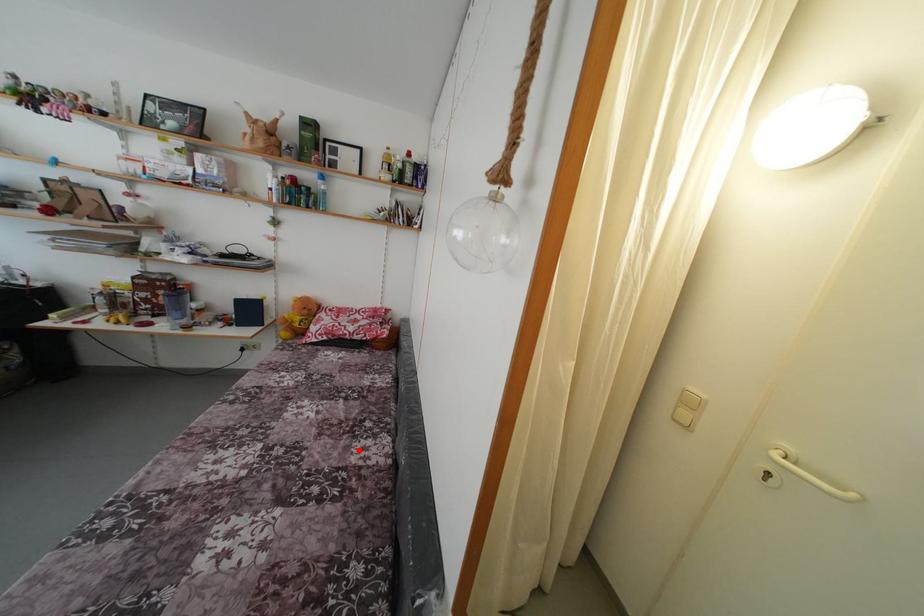
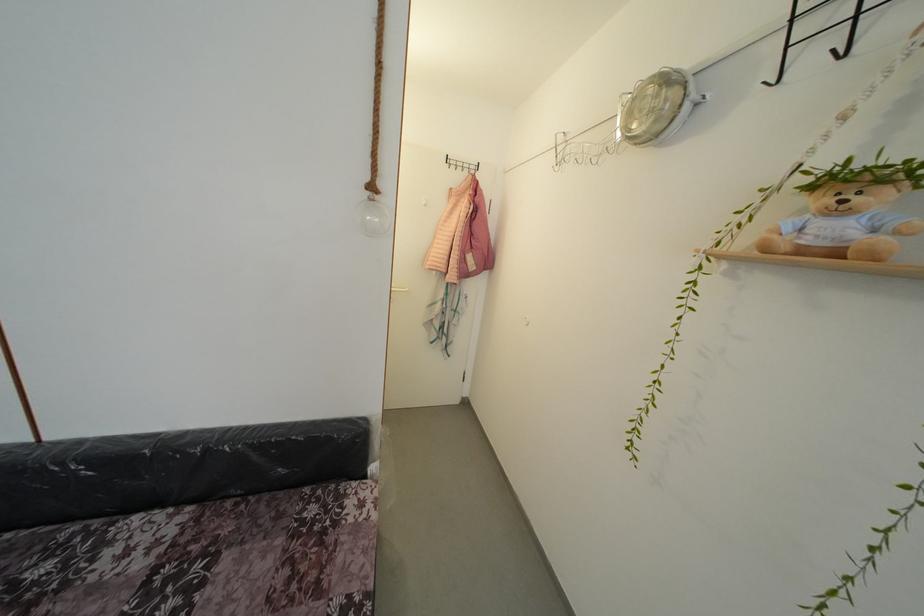
Question: I am providing you with two images of the same scene from different viewpoints. A red point is marked on the first image. At the location where the point appears in image 1, is it still visible in image 2?

Choices:
 (A) Yes
 (B) No

Answer: (A)